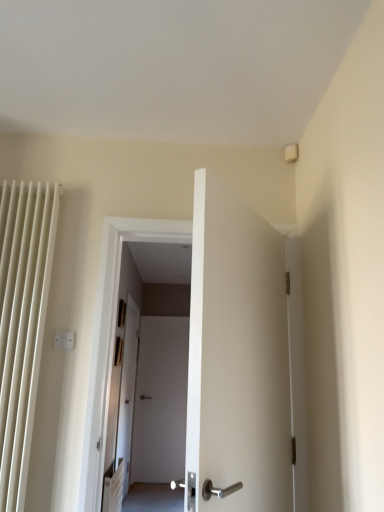
The image size is (384, 512). What do you see at coordinates (64, 340) in the screenshot?
I see `white plastic electric outlet at upper center` at bounding box center [64, 340].

The height and width of the screenshot is (512, 384). I want to click on white plastic electric outlet at upper center, so click(x=64, y=340).

The image size is (384, 512). What do you see at coordinates (153, 498) in the screenshot?
I see `satin silver door handle at center` at bounding box center [153, 498].

The width and height of the screenshot is (384, 512). In order to click on satin silver door handle at center in this screenshot , I will do `click(153, 498)`.

At what (x,y) coordinates should I click in order to perform the action: click on white plastic electric outlet at upper center. Please return your answer as a coordinate pair (x, y). The image size is (384, 512). Looking at the image, I should click on (64, 340).

Which object is positioned more to the right, satin silver door handle at center or white plastic electric outlet at upper center?

Positioned to the right is satin silver door handle at center.

Which object is further away from the camera taking this photo, satin silver door handle at center or white plastic electric outlet at upper center?

satin silver door handle at center.

Does point (161, 506) come closer to viewer compared to point (59, 331)?

That is False.

From the image's perspective, is satin silver door handle at center above white plastic electric outlet at upper center?

Incorrect, from the image's perspective, satin silver door handle at center is lower than white plastic electric outlet at upper center.

From a real-world perspective, is satin silver door handle at center physically above white plastic electric outlet at upper center?

Actually, satin silver door handle at center is physically below white plastic electric outlet at upper center in the real world.

Between satin silver door handle at center and white plastic electric outlet at upper center, which one has smaller width?

Thinner between the two is white plastic electric outlet at upper center.

Considering the sizes of objects satin silver door handle at center and white plastic electric outlet at upper center in the image provided, who is shorter, satin silver door handle at center or white plastic electric outlet at upper center?

satin silver door handle at center is shorter.

In terms of size, does satin silver door handle at center appear bigger or smaller than white plastic electric outlet at upper center?

Clearly, satin silver door handle at center is larger in size than white plastic electric outlet at upper center.

Is satin silver door handle at center not inside white plastic electric outlet at upper center?

Indeed, satin silver door handle at center is completely outside white plastic electric outlet at upper center.

Would you consider satin silver door handle at center to be distant from white plastic electric outlet at upper center?

Yes.

Is satin silver door handle at center oriented towards white plastic electric outlet at upper center?

No, satin silver door handle at center does not turn towards white plastic electric outlet at upper center.

Can you tell me how much satin silver door handle at center and white plastic electric outlet at upper center differ in facing direction?

0.0216 degrees.

Looking at this image, how distant is satin silver door handle at center from white plastic electric outlet at upper center?

The distance of satin silver door handle at center from white plastic electric outlet at upper center is 3.87 meters.

Find the location of a particular element. The image size is (384, 512). electric outlet located above the satin silver door handle at center (from a real-world perspective) is located at coordinates (x=64, y=340).

From the picture: Is white plastic electric outlet at upper center to the left of satin silver door handle at center from the viewer's perspective?

Yes.

Which object is closer to the camera taking this photo, white plastic electric outlet at upper center or satin silver door handle at center?

white plastic electric outlet at upper center is more forward.

Which is less distant, [63,338] or [182,498]?

Point [63,338].

From the image's perspective, which is below, white plastic electric outlet at upper center or satin silver door handle at center?

satin silver door handle at center is shown below in the image.

From a real-world perspective, which is physically above, white plastic electric outlet at upper center or satin silver door handle at center?

white plastic electric outlet at upper center is physically above.

Is white plastic electric outlet at upper center thinner than satin silver door handle at center?

Yes.

Based on the photo, does white plastic electric outlet at upper center have a greater height compared to satin silver door handle at center?

Indeed, white plastic electric outlet at upper center has a greater height compared to satin silver door handle at center.

Is white plastic electric outlet at upper center smaller than satin silver door handle at center?

Yes, white plastic electric outlet at upper center is smaller than satin silver door handle at center.

Is white plastic electric outlet at upper center not within satin silver door handle at center?

Yes, white plastic electric outlet at upper center is not within satin silver door handle at center.

Is white plastic electric outlet at upper center touching satin silver door handle at center?

No, white plastic electric outlet at upper center is not with satin silver door handle at center.

Is white plastic electric outlet at upper center facing towards satin silver door handle at center?

No, white plastic electric outlet at upper center is not turned towards satin silver door handle at center.

Measure the distance from white plastic electric outlet at upper center to satin silver door handle at center.

white plastic electric outlet at upper center and satin silver door handle at center are 3.87 meters apart from each other.

The image size is (384, 512). In order to click on path on the right of white plastic electric outlet at upper center in this screenshot , I will do `click(153, 498)`.

At what (x,y) coordinates should I click in order to perform the action: click on electric outlet in front of the satin silver door handle at center. Please return your answer as a coordinate pair (x, y). The image size is (384, 512). Looking at the image, I should click on (64, 340).

The width and height of the screenshot is (384, 512). I want to click on path below the white plastic electric outlet at upper center (from a real-world perspective), so click(x=153, y=498).